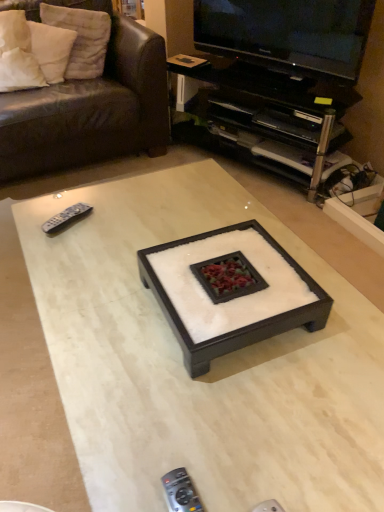
Question: Considering the positions of point (190, 373) and point (345, 50), is point (190, 373) closer or farther from the camera than point (345, 50)?

Choices:
 (A) farther
 (B) closer

Answer: (B)

Question: Is white felt square tray at center, positioned as the first coffee table in top-to-bottom order, wider or thinner than black glossy television at upper right?

Choices:
 (A) wide
 (B) thin

Answer: (A)

Question: Which object is the closest to the gray plastic remote at left, marked as the first remote control in a back-to-front arrangement?

Choices:
 (A) leather couch at upper left
 (B) white soft pillow at upper left, the first pillow in the left-to-right sequence
 (C) white felt square tray at center, the 2th coffee table positioned from the bottom
 (D) white cotton pillow at upper left, placed as the 1th pillow when sorted from right to left
 (E) white marble coffee table at center, the first coffee table when ordered from bottom to top

Answer: (E)

Question: Considering the real-world distances, which object is farthest from the black plastic tv stand at upper right?

Choices:
 (A) white marble coffee table at center, positioned as the 2th coffee table in top-to-bottom order
 (B) leather couch at upper left
 (C) white soft pillow at upper left, the first pillow in the left-to-right sequence
 (D) black plastic remote control at lower center, placed as the 1th remote control when sorted from front to back
 (E) gray plastic remote at left, the 2th remote control ordered from the bottom

Answer: (D)